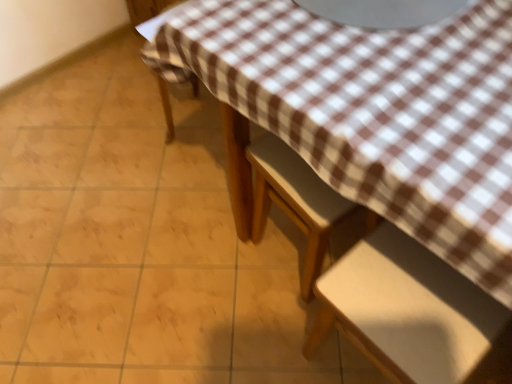
Image resolution: width=512 pixels, height=384 pixels. I want to click on vacant area situated to the left side of white matte chair at lower right, marked as the 3th chair in a top-to-bottom arrangement, so click(267, 332).